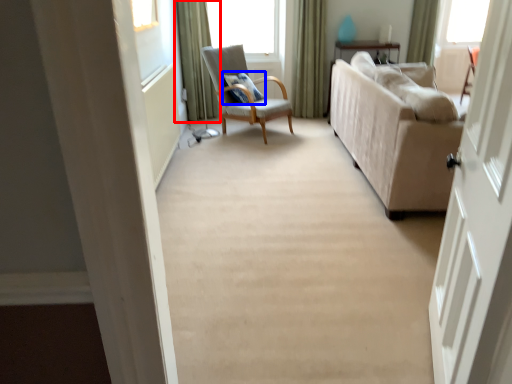
Question: Among these objects, which one is nearest to the camera, curtain (highlighted by a red box) or pillow (highlighted by a blue box)?

Choices:
 (A) curtain
 (B) pillow

Answer: (B)